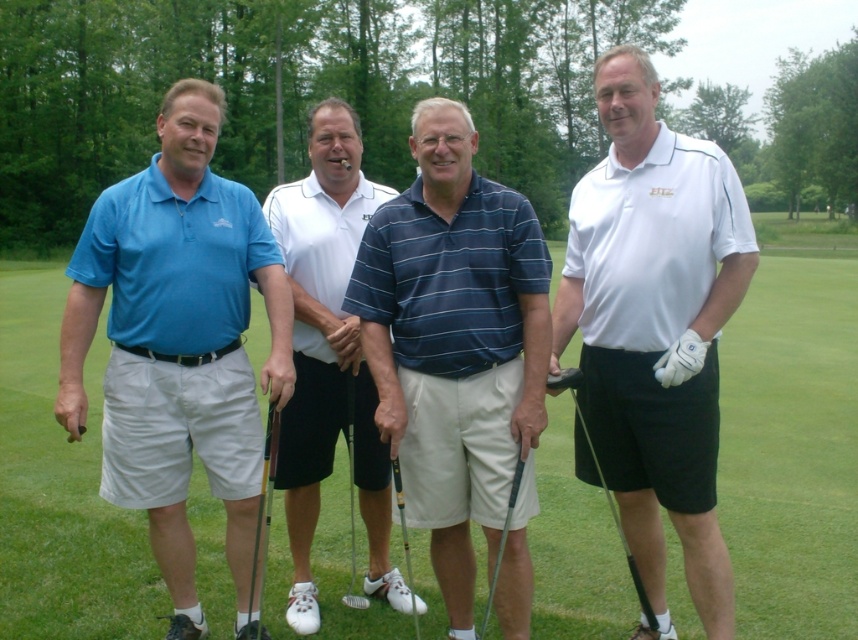
Question: Which point is farther to the camera?

Choices:
 (A) matte blue polo shirt at left
 (B) metallic shaft at lower left

Answer: (A)

Question: Which object is the farthest from the metallic silver golf club at center?

Choices:
 (A) metallic shaft at lower left
 (B) blue cotton polo shirt at left
 (C) polished silver putter at center
 (D) white smooth polo shirt at right

Answer: (D)

Question: Is white matte golf club at center bigger than polished silver putter at center?

Choices:
 (A) no
 (B) yes

Answer: (B)

Question: Can you confirm if matte blue polo shirt at left is positioned to the right of polished silver putter at center?

Choices:
 (A) no
 (B) yes

Answer: (A)

Question: Does green grass at center appear on the right side of white matte polo shirt at center?

Choices:
 (A) yes
 (B) no

Answer: (B)

Question: Among these objects, which one is farthest from the camera?

Choices:
 (A) metallic silver golf club at center
 (B) white matte golf club at center
 (C) white matte polo shirt at center
 (D) black rubber golf club at lower center

Answer: (C)